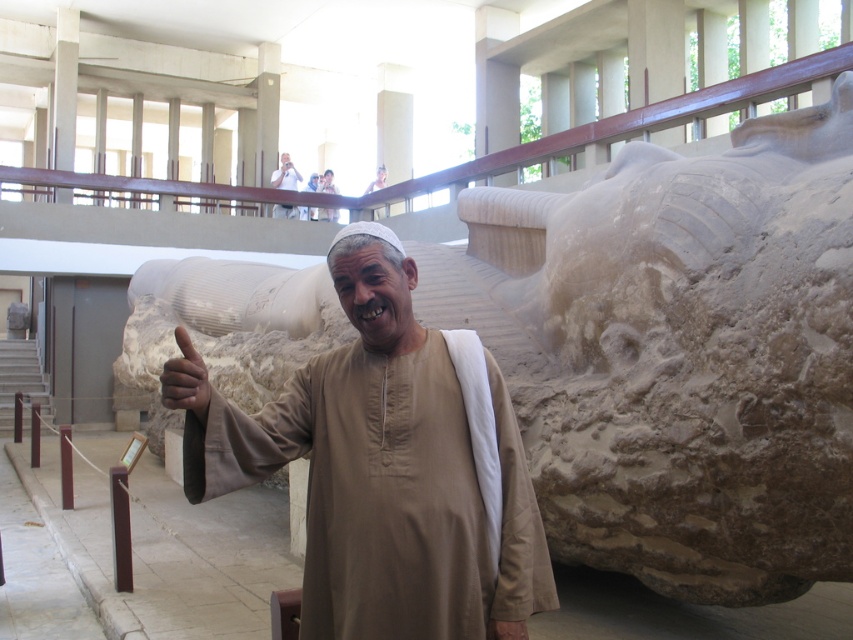
You are a photographer trying to capture the entire scene of the dark brown skin at thumb right and the white cotton robe at center in one shot. Given that your camera has a maximum zoom range of 25 meters, can you fit both subjects into the frame without moving closer?

The distance between the dark brown skin at thumb right and the white cotton robe at center is 27.02 meters. Since your camera can only zoom up to 25 meters, you cannot capture both subjects in a single frame without moving closer.

You are an anthropologist examining the clothing of the man in the image. Based on the description provided, can you determine which item of clothing is wider in width between the brown matte shirt at center and the white cotton robe at center?

The brown matte shirt at center might be wider than white cotton robe at center according to the description provided.

You are an anthropologist observing the scene. You notice the dark brown skin at thumb right and the white cotton robe at center. Which object is taller in the image?

The white cotton robe at center is taller than the dark brown skin at thumb right.